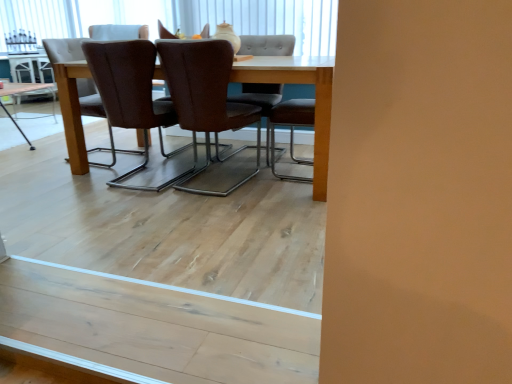
Question: Does light wood table at center, marked as the 2th table in a front-to-back arrangement, turn towards brown leather chair at center, acting as the 2th chair starting from the front?

Choices:
 (A) yes
 (B) no

Answer: (A)

Question: Is light wood table at center, marked as the 2th table in a front-to-back arrangement, to the left of brown leather chair at center, acting as the 2th chair starting from the front, from the viewer's perspective?

Choices:
 (A) yes
 (B) no

Answer: (A)

Question: Is the position of light wood table at center, the 1th table viewed from the left, more distant than that of brown leather chair at center, acting as the 4th chair starting from the back?

Choices:
 (A) no
 (B) yes

Answer: (B)

Question: From a real-world perspective, is light wood table at center, marked as the 2th table in a front-to-back arrangement, under brown leather chair at center, acting as the 2th chair starting from the front?

Choices:
 (A) no
 (B) yes

Answer: (B)

Question: Would you say light wood table at center, acting as the second table starting from the right, contains brown leather chair at center, acting as the 2th chair starting from the front?

Choices:
 (A) no
 (B) yes

Answer: (A)

Question: Considering the relative positions of light wood table at center, acting as the second table starting from the right, and brown leather chair at center, acting as the 2th chair starting from the front, in the image provided, is light wood table at center, acting as the second table starting from the right, to the left or to the right of brown leather chair at center, acting as the 2th chair starting from the front,?

Choices:
 (A) left
 (B) right

Answer: (A)

Question: Considering the positions of light wood table at center, marked as the 2th table in a front-to-back arrangement, and brown leather chair at center, acting as the 2th chair starting from the front, in the image, is light wood table at center, marked as the 2th table in a front-to-back arrangement, taller or shorter than brown leather chair at center, acting as the 2th chair starting from the front,?

Choices:
 (A) short
 (B) tall

Answer: (A)

Question: Looking at their shapes, would you say light wood table at center, the 1th table viewed from the left, is wider or thinner than brown leather chair at center, acting as the 4th chair starting from the back?

Choices:
 (A) wide
 (B) thin

Answer: (B)

Question: Is light wood table at center, acting as the second table starting from the right, situated inside brown leather chair at center, acting as the 4th chair starting from the back, or outside?

Choices:
 (A) inside
 (B) outside

Answer: (B)

Question: Is white leather chair at upper center, the first chair in the back-to-front sequence, taller or shorter than brown leather chair at center, the fifth chair positioned from the back?

Choices:
 (A) tall
 (B) short

Answer: (B)

Question: Is white leather chair at upper center, the 5th chair when ordered from front to back, to the left or to the right of brown leather chair at center, acting as the 1th chair starting from the front, in the image?

Choices:
 (A) left
 (B) right

Answer: (A)

Question: In terms of width, does white leather chair at upper center, the first chair in the back-to-front sequence, look wider or thinner when compared to brown leather chair at center, acting as the 1th chair starting from the front?

Choices:
 (A) wide
 (B) thin

Answer: (A)

Question: In the image, is white leather chair at upper center, the 5th chair when ordered from front to back, positioned in front of or behind brown leather chair at center, acting as the 1th chair starting from the front?

Choices:
 (A) front
 (B) behind

Answer: (B)

Question: Is white leather chair at upper center, the first chair in the back-to-front sequence, in front of or behind brown leather chair at center, which appears as the 3th chair when viewed from the front, in the image?

Choices:
 (A) behind
 (B) front

Answer: (A)

Question: Is white leather chair at upper center, the first chair in the back-to-front sequence, to the left or to the right of brown leather chair at center, which appears as the 3th chair when viewed from the front, in the image?

Choices:
 (A) right
 (B) left

Answer: (B)